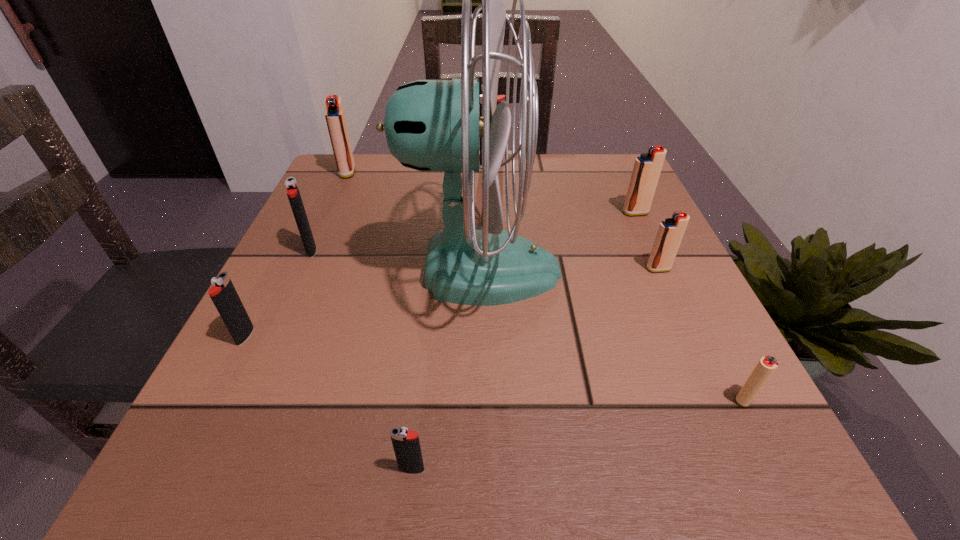
Locate an element on the screen. The height and width of the screenshot is (540, 960). teal fan is located at coordinates (430, 125).

Locate an element on the screen. the tallest object is located at coordinates (430, 125).

At what (x,y) coordinates should I click in order to perform the action: click on the biggest red igniter. Please return your answer as a coordinate pair (x, y). The height and width of the screenshot is (540, 960). Looking at the image, I should click on (335, 117).

In order to click on the leftmost red igniter in this screenshot , I will do `click(335, 117)`.

You are a GUI agent. You are given a task and a screenshot of the screen. Output one action in this format:
    pyautogui.click(x=<x>, y=<y>)
    Task: Click on the farthest black igniter
    The height and width of the screenshot is (540, 960).
    Given the screenshot: What is the action you would take?
    pyautogui.click(x=500, y=98)

You are a GUI agent. You are given a task and a screenshot of the screen. Output one action in this format:
    pyautogui.click(x=<x>, y=<y>)
    Task: Click on the rightmost black igniter
    The height and width of the screenshot is (540, 960).
    Given the screenshot: What is the action you would take?
    pyautogui.click(x=500, y=98)

At what (x,y) coordinates should I click in order to perform the action: click on the third nearest red igniter. Please return your answer as a coordinate pair (x, y). Looking at the image, I should click on (647, 167).

The height and width of the screenshot is (540, 960). Identify the location of the third smallest red igniter. (647, 167).

Locate an element on the screen. The height and width of the screenshot is (540, 960). the third nearest black igniter is located at coordinates (292, 190).

The image size is (960, 540). I want to click on the third black igniter from right to left, so click(292, 190).